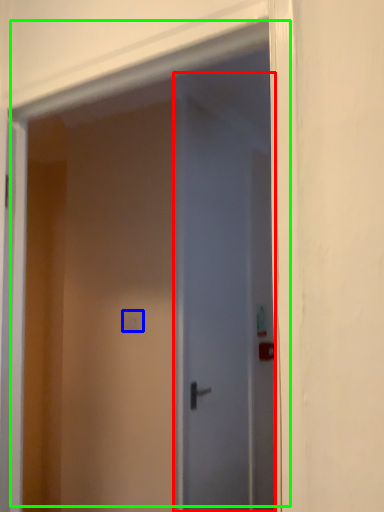
Question: Which object is the farthest from door (highlighted by a red box)? Choose among these: light switch (highlighted by a blue box) or door (highlighted by a green box).

Choices:
 (A) light switch
 (B) door

Answer: (A)